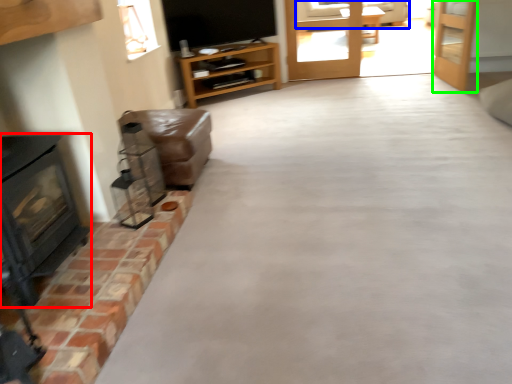
Question: Based on their relative distances, which object is farther from wood burning stove (highlighted by a red box)? Choose from couch (highlighted by a blue box) and door (highlighted by a green box).

Choices:
 (A) couch
 (B) door

Answer: (A)